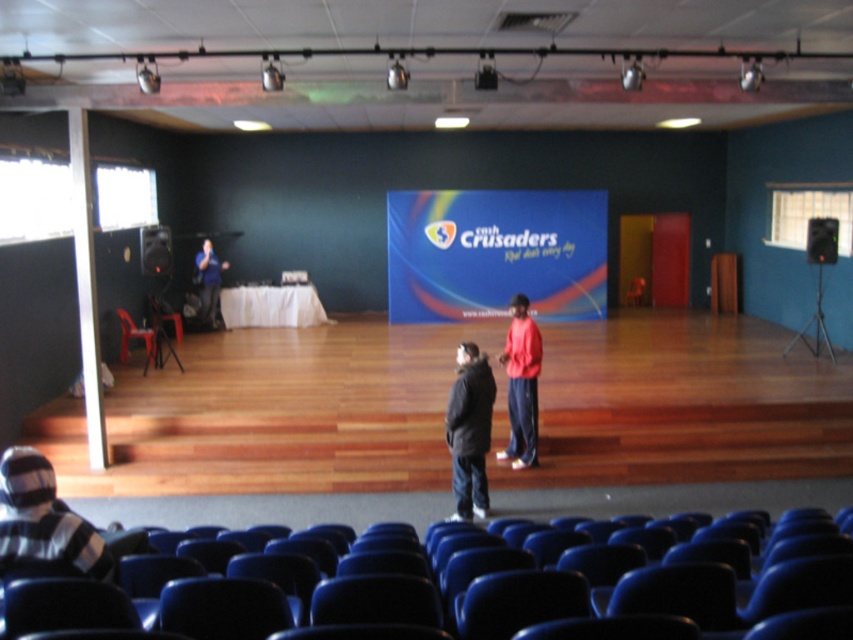
Question: Can you confirm if blue fabric screen at center is thinner than matte red shirt at center?

Choices:
 (A) yes
 (B) no

Answer: (B)

Question: Which point is farther to the camera?

Choices:
 (A) matte black shirt at left
 (B) striped knit hat at lower left
 (C) blue fabric screen at center

Answer: (C)

Question: Which of these objects is positioned farthest from the black matte jacket at center?

Choices:
 (A) blue fabric screen at center
 (B) striped knit hat at lower left
 (C) matte red shirt at center

Answer: (A)

Question: Does black matte jacket at center come in front of matte black shirt at left?

Choices:
 (A) yes
 (B) no

Answer: (A)

Question: Does blue fabric screen at center have a lesser width compared to matte red shirt at center?

Choices:
 (A) no
 (B) yes

Answer: (A)

Question: Which point is farther to the camera?

Choices:
 (A) blue fabric screen at center
 (B) black matte jacket at center

Answer: (A)